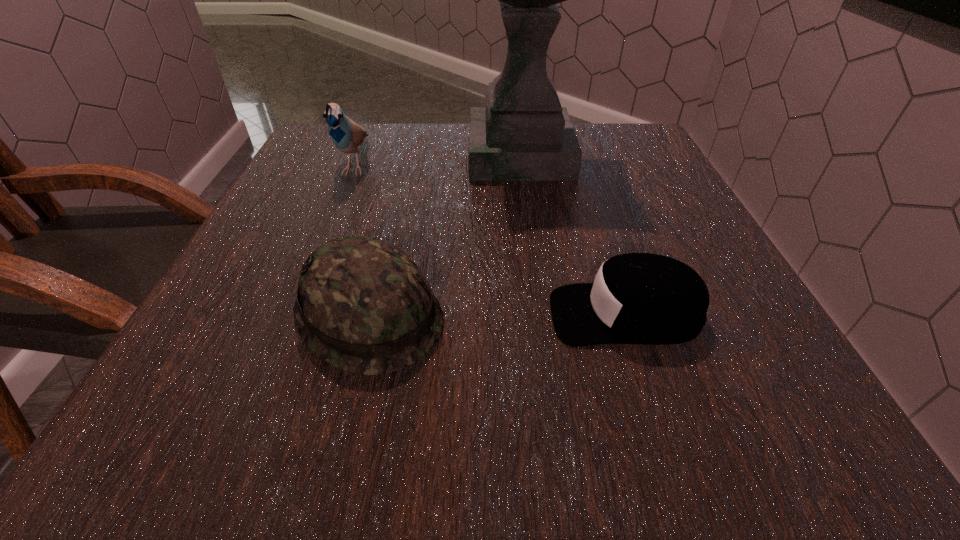
This screenshot has height=540, width=960. Find the location of `blank space at the far edge`. blank space at the far edge is located at coordinates (374, 166).

In the image, there is a desktop. At what (x,y) coordinates should I click in order to perform the action: click on vacant space at the near edge. Please return your answer as a coordinate pair (x, y). Looking at the image, I should click on (447, 414).

The width and height of the screenshot is (960, 540). What are the coordinates of `vacant space at the left edge of the desktop` in the screenshot? It's located at (359, 188).

In the image, there is a desktop. At what (x,y) coordinates should I click in order to perform the action: click on free space at the right edge. Please return your answer as a coordinate pair (x, y). Looking at the image, I should click on (698, 367).

Where is `free spot at the near left corner of the desktop`? Image resolution: width=960 pixels, height=540 pixels. free spot at the near left corner of the desktop is located at coordinates (201, 417).

Locate an element on the screen. free space at the far right corner of the desktop is located at coordinates (639, 159).

In order to click on free space at the near right corner of the desktop in this screenshot , I will do `click(774, 449)`.

Locate an element on the screen. The width and height of the screenshot is (960, 540). vacant space in between the taller cap and the right cap is located at coordinates [497, 315].

Image resolution: width=960 pixels, height=540 pixels. I want to click on free space between the shortest object and the bird, so click(x=491, y=239).

At what (x,y) coordinates should I click in order to perform the action: click on vacant region between the tallest object and the second shortest object. Please return your answer as a coordinate pair (x, y). Looking at the image, I should click on (444, 235).